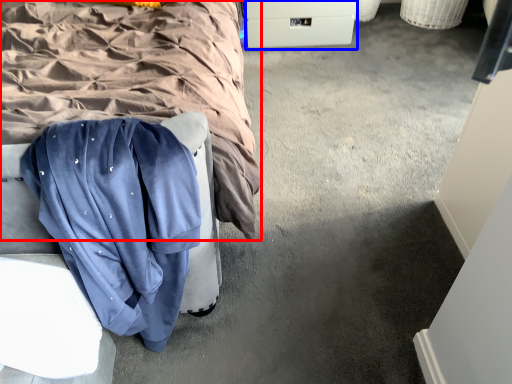
Question: Which object appears farthest to the camera in this image, bed (highlighted by a red box) or drawer (highlighted by a blue box)?

Choices:
 (A) bed
 (B) drawer

Answer: (B)